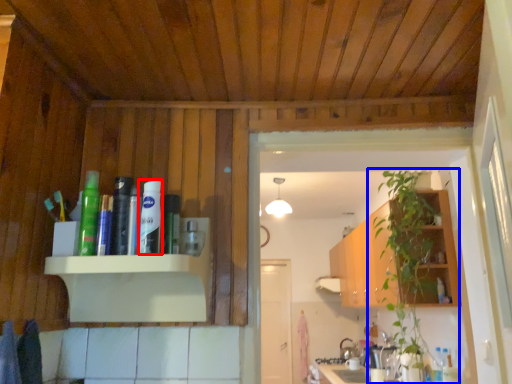
Question: Which object is further to the camera taking this photo, toiletry (highlighted by a red box) or houseplant (highlighted by a blue box)?

Choices:
 (A) toiletry
 (B) houseplant

Answer: (B)